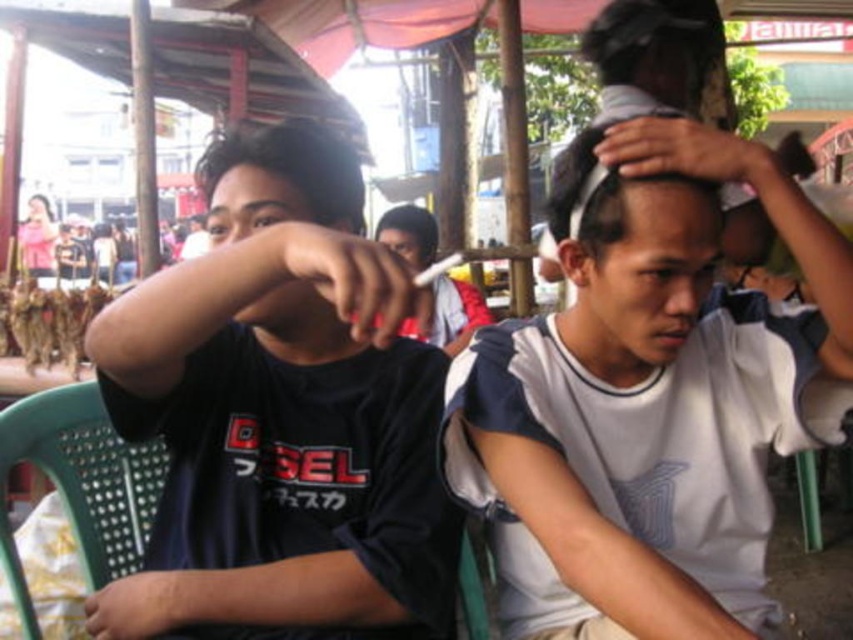
Consider the image. You are standing at the entrance of the market and looking towards the canopy. There is a white matte head at center and a dark brown hair at upper left. Which one is positioned higher in the image?

The white matte head at center is positioned higher than the dark brown hair at upper left in the image.

You are an observer standing in front of the scene. You notice the black matte shirt at left and the dark brown hair at upper left. Which object is taller?

The black matte shirt at left is taller than the dark brown hair at upper left.

Please describe the position of the white matte head at center in terms of coordinates within the image frame. The image frame has a coordinate system where the bottom left corner is the origin point. The x and y axes increase to the right and upwards respectively. The coordinates are normalized between 0 and 1. Please provide the coordinates as a tuple of two decimal numbers rounded to three decimal places. The answer should be in the format of a tuple like this example format, e.g., 0.123, 0.456. The user

The white matte head at center is located at coordinates (633, 250) within the image frame.